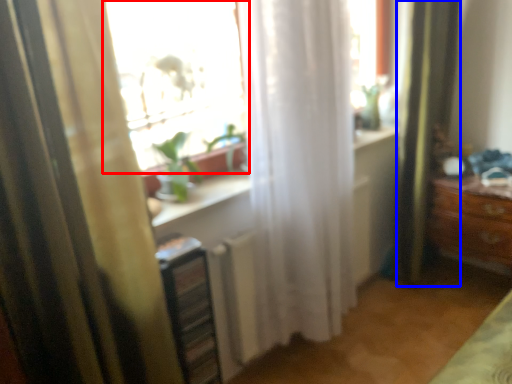
Question: Among these objects, which one is nearest to the camera, window (highlighted by a red box) or shower curtain (highlighted by a blue box)?

Choices:
 (A) window
 (B) shower curtain

Answer: (A)